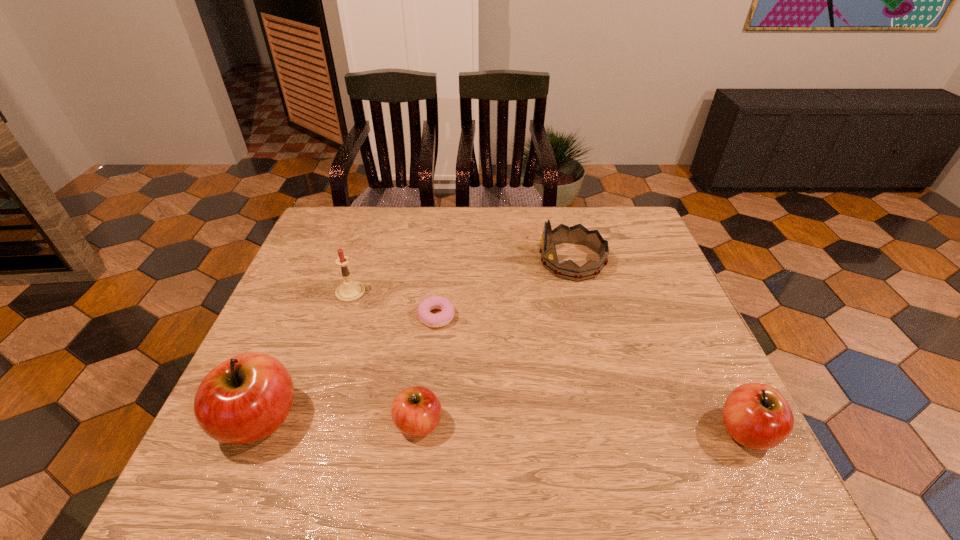
You are a GUI agent. You are given a task and a screenshot of the screen. Output one action in this format:
    pyautogui.click(x=<x>, y=<y>)
    Task: Click on the vacant position for inserting another apple evenly
    The image size is (960, 540).
    Given the screenshot: What is the action you would take?
    pyautogui.click(x=581, y=427)